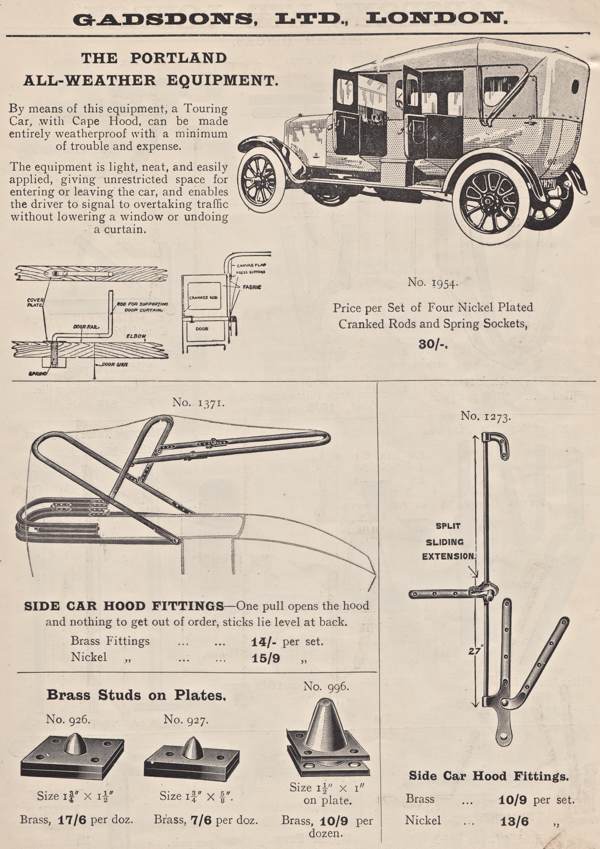
You are a GUI agent. You are given a task and a screenshot of the screen. Output one action in this format:
    pyautogui.click(x=<x>, y=<y>)
    Task: Click on the brass plates
    This screenshot has height=849, width=600.
    Given the screenshot: What is the action you would take?
    (48, 761), (175, 762), (336, 738)